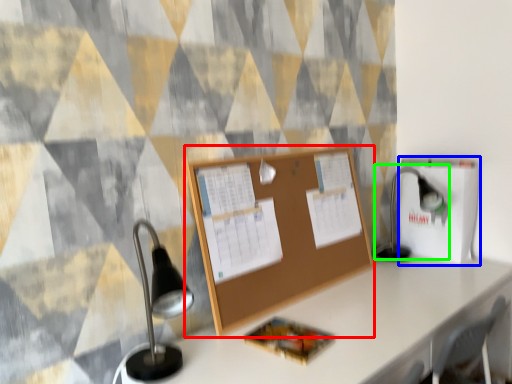
Question: Based on their relative distances, which object is nearer to bulletin board (highlighted by a red box)? Choose from cardboard box (highlighted by a blue box) and table lamp (highlighted by a green box).

Choices:
 (A) cardboard box
 (B) table lamp

Answer: (A)